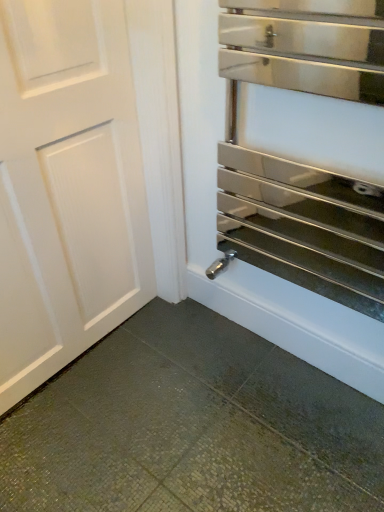
Question: Considering the relative sizes of polished stainless steel oven at right and white matte door at left in the image provided, is polished stainless steel oven at right wider than white matte door at left?

Choices:
 (A) yes
 (B) no

Answer: (A)

Question: From the image's perspective, is polished stainless steel oven at right on white matte door at left?

Choices:
 (A) no
 (B) yes

Answer: (B)

Question: Would you say white matte door at left is part of polished stainless steel oven at right's contents?

Choices:
 (A) no
 (B) yes

Answer: (A)

Question: From a real-world perspective, does polished stainless steel oven at right stand above white matte door at left?

Choices:
 (A) no
 (B) yes

Answer: (B)

Question: Is polished stainless steel oven at right to the right of white matte door at left from the viewer's perspective?

Choices:
 (A) no
 (B) yes

Answer: (B)

Question: From the image's perspective, is polished stainless steel oven at right located beneath white matte door at left?

Choices:
 (A) no
 (B) yes

Answer: (A)

Question: Can you confirm if white matte door at left is positioned to the right of polished stainless steel oven at right?

Choices:
 (A) no
 (B) yes

Answer: (A)

Question: Does white matte door at left have a greater height compared to polished stainless steel oven at right?

Choices:
 (A) no
 (B) yes

Answer: (B)

Question: Is white matte door at left next to polished stainless steel oven at right?

Choices:
 (A) no
 (B) yes

Answer: (A)

Question: Is white matte door at left smaller than polished stainless steel oven at right?

Choices:
 (A) no
 (B) yes

Answer: (A)

Question: Does white matte door at left appear on the left side of polished stainless steel oven at right?

Choices:
 (A) yes
 (B) no

Answer: (A)

Question: Does white matte door at left have a larger size compared to polished stainless steel oven at right?

Choices:
 (A) yes
 (B) no

Answer: (A)

Question: Considering the positions of polished stainless steel oven at right and white matte door at left in the image, is polished stainless steel oven at right wider or thinner than white matte door at left?

Choices:
 (A) thin
 (B) wide

Answer: (B)